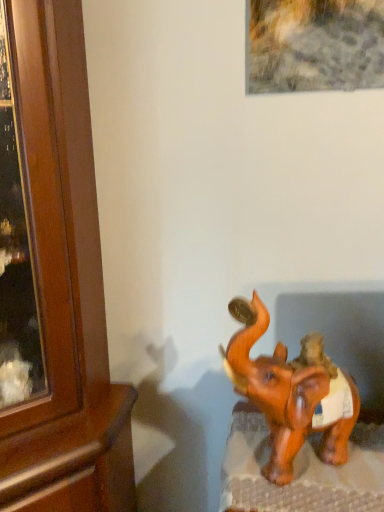
Question: Is wooden cabinet at left at the left side of brown glossy elephant at lower right?

Choices:
 (A) no
 (B) yes

Answer: (B)

Question: Can you confirm if wooden cabinet at left is smaller than brown glossy elephant at lower right?

Choices:
 (A) no
 (B) yes

Answer: (A)

Question: Is wooden cabinet at left not inside brown glossy elephant at lower right?

Choices:
 (A) yes
 (B) no

Answer: (A)

Question: Are wooden cabinet at left and brown glossy elephant at lower right far apart?

Choices:
 (A) yes
 (B) no

Answer: (B)

Question: Is wooden cabinet at left oriented towards brown glossy elephant at lower right?

Choices:
 (A) no
 (B) yes

Answer: (A)

Question: Are wooden cabinet at left and brown glossy elephant at lower right beside each other?

Choices:
 (A) yes
 (B) no

Answer: (B)

Question: Is brown glossy elephant at lower right bigger than wooden cabinet at left?

Choices:
 (A) yes
 (B) no

Answer: (B)

Question: Is brown glossy elephant at lower right shorter than wooden cabinet at left?

Choices:
 (A) yes
 (B) no

Answer: (A)

Question: Is brown glossy elephant at lower right positioned behind wooden cabinet at left?

Choices:
 (A) yes
 (B) no

Answer: (A)

Question: Is brown glossy elephant at lower right thinner than wooden cabinet at left?

Choices:
 (A) yes
 (B) no

Answer: (A)

Question: Considering the relative positions of brown glossy elephant at lower right and wooden cabinet at left in the image provided, is brown glossy elephant at lower right to the left of wooden cabinet at left from the viewer's perspective?

Choices:
 (A) no
 (B) yes

Answer: (A)

Question: From a real-world perspective, is brown glossy elephant at lower right over wooden cabinet at left?

Choices:
 (A) yes
 (B) no

Answer: (A)

Question: Is wooden cabinet at left wider or thinner than brown glossy elephant at lower right?

Choices:
 (A) wide
 (B) thin

Answer: (A)